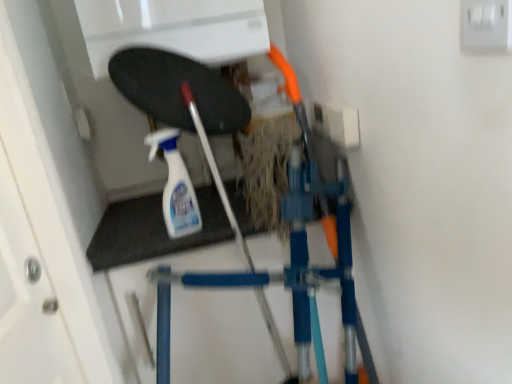
Where is `free location to the right of clear plastic spray bottle at center`? The image size is (512, 384). free location to the right of clear plastic spray bottle at center is located at coordinates (225, 225).